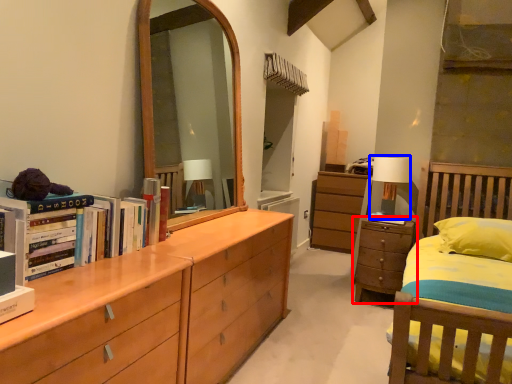
Question: Which of the following is the closest to the observer, chest of drawers (highlighted by a red box) or table lamp (highlighted by a blue box)?

Choices:
 (A) chest of drawers
 (B) table lamp

Answer: (A)